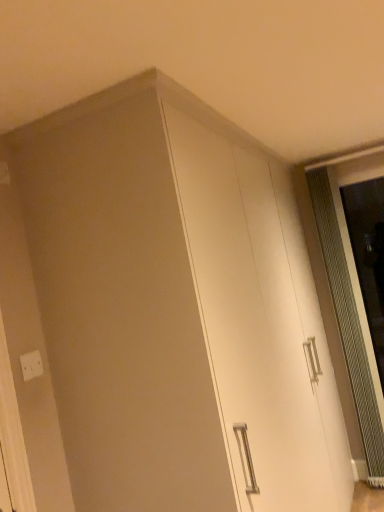
Question: Is white glossy cabinet at center facing towards clear glass screen door at right?

Choices:
 (A) no
 (B) yes

Answer: (B)

Question: Is white glossy cabinet at center next to clear glass screen door at right and touching it?

Choices:
 (A) no
 (B) yes

Answer: (A)

Question: Would you say clear glass screen door at right is part of white glossy cabinet at center's contents?

Choices:
 (A) yes
 (B) no

Answer: (B)

Question: Is white glossy cabinet at center shorter than clear glass screen door at right?

Choices:
 (A) yes
 (B) no

Answer: (B)

Question: Would you consider white glossy cabinet at center to be distant from clear glass screen door at right?

Choices:
 (A) no
 (B) yes

Answer: (B)

Question: Is point (306, 389) positioned closer to the camera than point (367, 278)?

Choices:
 (A) closer
 (B) farther

Answer: (A)

Question: Is white glossy cabinet at center spatially inside clear glass screen door at right, or outside of it?

Choices:
 (A) inside
 (B) outside

Answer: (B)

Question: Relative to clear glass screen door at right, is white glossy cabinet at center in front or behind?

Choices:
 (A) front
 (B) behind

Answer: (A)

Question: In terms of width, does white glossy cabinet at center look wider or thinner when compared to clear glass screen door at right?

Choices:
 (A) wide
 (B) thin

Answer: (A)

Question: Is point (31, 374) closer or farther from the camera than point (324, 397)?

Choices:
 (A) closer
 (B) farther

Answer: (A)

Question: From their relative heights in the image, would you say white plastic electric outlet at lower left is taller or shorter than white glossy cabinet at center?

Choices:
 (A) tall
 (B) short

Answer: (B)

Question: From the image's perspective, is white plastic electric outlet at lower left positioned above or below white glossy cabinet at center?

Choices:
 (A) below
 (B) above

Answer: (B)

Question: Is white plastic electric outlet at lower left bigger or smaller than white glossy cabinet at center?

Choices:
 (A) small
 (B) big

Answer: (A)

Question: Do you think clear glass screen door at right is within white plastic electric outlet at lower left, or outside of it?

Choices:
 (A) outside
 (B) inside

Answer: (A)

Question: In terms of width, does clear glass screen door at right look wider or thinner when compared to white plastic electric outlet at lower left?

Choices:
 (A) wide
 (B) thin

Answer: (A)